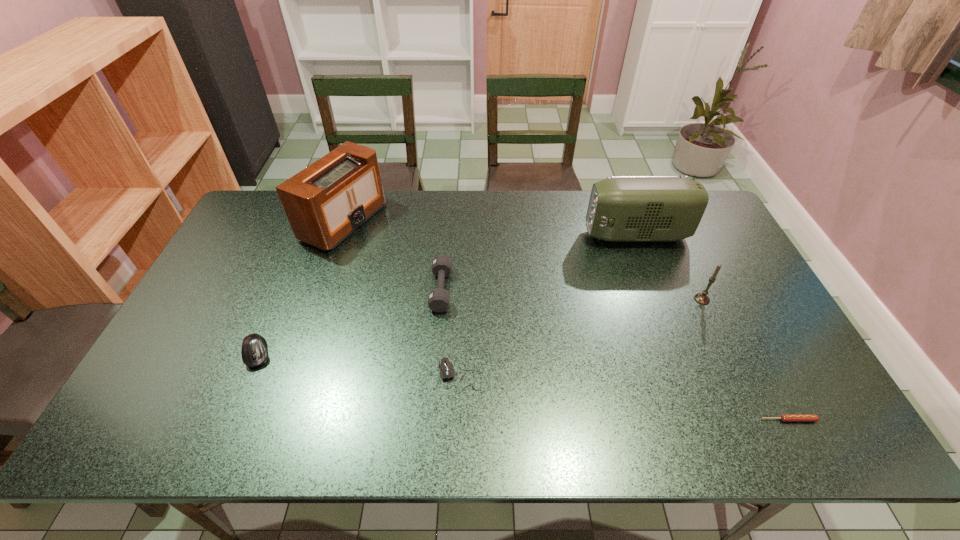
Where is `the left radio_receiver`? The width and height of the screenshot is (960, 540). the left radio_receiver is located at coordinates (327, 201).

The width and height of the screenshot is (960, 540). I want to click on the right radio_receiver, so click(x=621, y=208).

This screenshot has width=960, height=540. In order to click on candle in this screenshot , I will do `click(702, 298)`.

The height and width of the screenshot is (540, 960). I want to click on dumbbell, so click(438, 299).

The image size is (960, 540). I want to click on the fifth tallest object, so pos(254,352).

Find the location of a particular element. The image size is (960, 540). the taller computer mouse is located at coordinates (254, 352).

Where is `the shorter computer mouse`? the shorter computer mouse is located at coordinates (446, 368).

The image size is (960, 540). In order to click on the right computer mouse in this screenshot , I will do `click(446, 368)`.

The image size is (960, 540). I want to click on sausage, so click(784, 417).

The width and height of the screenshot is (960, 540). What are the coordinates of `the nearest object` in the screenshot? It's located at (784, 417).